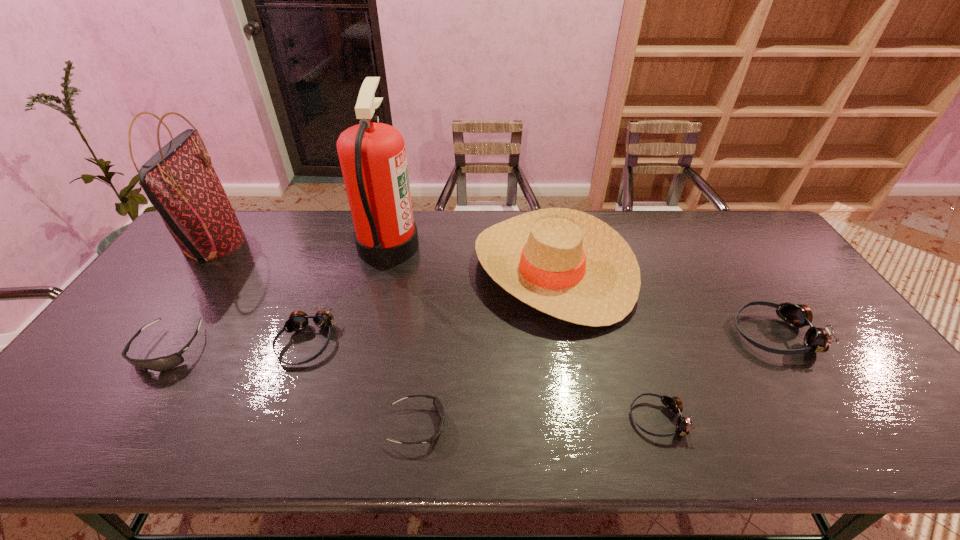
The height and width of the screenshot is (540, 960). I want to click on the nearest bronze goggles, so click(674, 404).

Locate an element on the screen. the fourth object from right to left is located at coordinates (437, 403).

You are a GUI agent. You are given a task and a screenshot of the screen. Output one action in this format:
    pyautogui.click(x=<x>, y=<y>)
    Task: Click on the right black goggles
    
    Given the screenshot: What is the action you would take?
    pyautogui.click(x=437, y=403)

The image size is (960, 540). Find the location of `free region located 0.280m at the nozzle of the red fire extinguisher`. free region located 0.280m at the nozzle of the red fire extinguisher is located at coordinates (502, 246).

You are a GUI agent. You are given a task and a screenshot of the screen. Output one action in this format:
    pyautogui.click(x=<x>, y=<y>)
    Task: Click on the vacant space situated on the front of the handbag
    
    Given the screenshot: What is the action you would take?
    pyautogui.click(x=148, y=334)

Find the location of `free space located on the left of the sunhat`. free space located on the left of the sunhat is located at coordinates (386, 270).

What are the coordinates of `free location located through the lenses of the rightmost bronze goggles` in the screenshot? It's located at (639, 334).

Where is `vacant space situated 0.210m through the lenses of the rightmost bronze goggles`? The image size is (960, 540). vacant space situated 0.210m through the lenses of the rightmost bronze goggles is located at coordinates (658, 334).

You are a GUI agent. You are given a task and a screenshot of the screen. Output one action in this format:
    pyautogui.click(x=<x>, y=<y>)
    Task: Click on the vacant space situated 0.100m through the lenses of the rightmost bronze goggles
    
    Given the screenshot: What is the action you would take?
    pyautogui.click(x=699, y=334)

Image resolution: width=960 pixels, height=540 pixels. What are the coordinates of `vacant space located 0.070m through the lenses of the leftmost bronze goggles` in the screenshot? It's located at (287, 393).